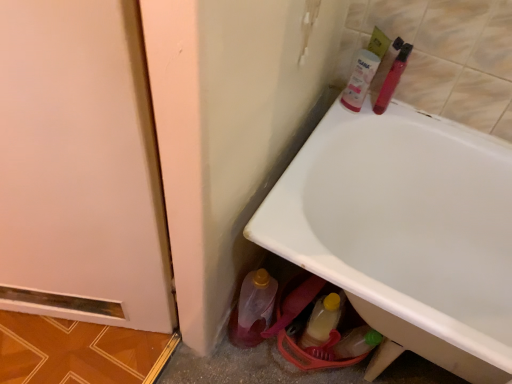
You are a GUI agent. You are given a task and a screenshot of the screen. Output one action in this format:
    pyautogui.click(x=<x>, y=<y>)
    Task: Click on the free spot to the right of translucent plastic tube at upper right, which is the second mouthwash from left to right
    Image resolution: width=512 pixels, height=384 pixels.
    Given the screenshot: What is the action you would take?
    pyautogui.click(x=420, y=119)